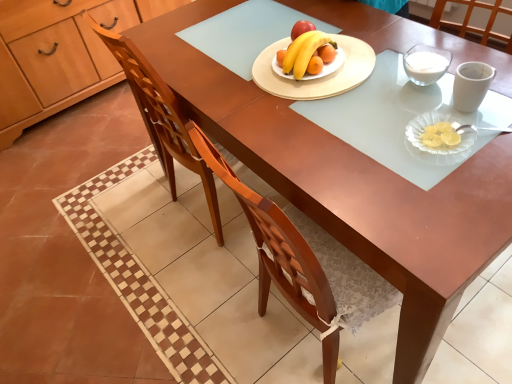
What do you see at coordinates (161, 117) in the screenshot?
I see `wooden chair at center` at bounding box center [161, 117].

The width and height of the screenshot is (512, 384). I want to click on yellow matte banana at center, so click(304, 52).

This screenshot has width=512, height=384. I want to click on wooden chair at center, so click(x=161, y=117).

Which of these two, wooden chair at center or yellow matte banana at center, is bigger?

Bigger between the two is wooden chair at center.

Is wooden chair at center thinner than yellow matte banana at center?

Incorrect, the width of wooden chair at center is not less than that of yellow matte banana at center.

Based on the photo, which is more to the left, wooden chair at center or yellow matte banana at center?

Result: Positioned to the left is wooden chair at center.

Is point (160, 140) in front of point (284, 67)?

That is False.

Is wooden cabinet at left facing away from yellow matte banana at center?

wooden cabinet at left does not have its back to yellow matte banana at center.

Based on the photo, from a real-world perspective, does wooden cabinet at left sit lower than yellow matte banana at center?

Yes, from a real-world perspective, wooden cabinet at left is beneath yellow matte banana at center.

From the image's perspective, between wooden cabinet at left and yellow matte banana at center, who is located below?

yellow matte banana at center, from the image's perspective.

Considering the points (63, 30) and (300, 72), which point is in front, point (63, 30) or point (300, 72)?

The point (300, 72) is more forward.

From the image's perspective, which one is positioned higher, yellow matte banana at center or wooden cabinet at left?

wooden cabinet at left is shown above in the image.

Identify the location of banana that is above the wooden cabinet at left (from a real-world perspective). Image resolution: width=512 pixels, height=384 pixels. (304, 52).

Looking at this image, is yellow matte banana at center with wooden cabinet at left?

No, yellow matte banana at center is not next to wooden cabinet at left.

How many degrees apart are the facing directions of yellow matte banana at center and clear glass platter at lower right, which is the first platter from bottom to top?

0.000267 degrees separate the facing orientations of yellow matte banana at center and clear glass platter at lower right, which is the first platter from bottom to top.

Who is more distant, yellow matte banana at center or clear glass platter at lower right, which is the first platter from bottom to top?

yellow matte banana at center is further from the camera.

Considering the points (302, 38) and (463, 148), which point is in front, point (302, 38) or point (463, 148)?

Point (463, 148)

Between yellow matte banana at center and clear glass platter at lower right, positioned as the first platter in front-to-back order, which one has more height?

yellow matte banana at center is taller.

Could you tell me if yellow matte banana at center is facing wooden chair at center?

No, yellow matte banana at center is not facing towards wooden chair at center.

Is yellow matte banana at center bigger or smaller than wooden chair at center?

Clearly, yellow matte banana at center is smaller in size than wooden chair at center.

From the image's perspective, is yellow matte banana at center positioned above or below wooden chair at center?

From the image's perspective, yellow matte banana at center appears above wooden chair at center.

Would you consider yellow matte banana at center to be distant from wooden chair at center?

Actually, yellow matte banana at center and wooden chair at center are a little close together.

Is the surface of wooden chair at center in direct contact with wooden cabinet at left?

wooden chair at center and wooden cabinet at left are not in contact.

Considering the relative sizes of wooden chair at center and wooden cabinet at left in the image provided, is wooden chair at center smaller than wooden cabinet at left?

Correct, wooden chair at center occupies less space than wooden cabinet at left.

Is wooden chair at center positioned with its back to wooden cabinet at left?

wooden chair at center does not have its back to wooden cabinet at left.

Is wooden chair at center shorter than wooden cabinet at left?

In fact, wooden chair at center may be taller than wooden cabinet at left.

Image resolution: width=512 pixels, height=384 pixels. I want to click on platter that is the 2nd one when counting rightward from the wooden chair at center, so click(432, 124).

From their relative heights in the image, would you say clear glass platter at lower right, positioned as the first platter in front-to-back order, is taller or shorter than wooden chair at center?

Clearly, clear glass platter at lower right, positioned as the first platter in front-to-back order, is shorter compared to wooden chair at center.

Based on their positions, is clear glass platter at lower right, which is the first platter from bottom to top, located to the left or right of wooden chair at center?

clear glass platter at lower right, which is the first platter from bottom to top, is positioned on wooden chair at center's right side.

From a real-world perspective, is clear glass platter at lower right, positioned as the 2th platter in top-to-bottom order, located higher than wooden chair at center?

Yes, from a real-world perspective, clear glass platter at lower right, positioned as the 2th platter in top-to-bottom order, is on top of wooden chair at center.

Identify the location of banana above the wooden chair at center (from the image's perspective). This screenshot has width=512, height=384. (304, 52).

Find the location of a particular element. cabinetry that is behind the yellow matte banana at center is located at coordinates (60, 54).

Based on their spatial positions, is clear glass platter at lower right, placed as the 1th platter when sorted from right to left, or yellow matte banana at center further from wooden chair at center?

clear glass platter at lower right, placed as the 1th platter when sorted from right to left, is further to wooden chair at center.

Which object lies further to the anchor point wooden cabinet at left, wooden chair at center or clear glass platter at lower right, which appears as the second platter when viewed from the left?

clear glass platter at lower right, which appears as the second platter when viewed from the left, is positioned further to the anchor wooden cabinet at left.

Estimate the real-world distances between objects in this image. Which object is closer to wooden round platter at center, which is counted as the first platter, starting from the left, wooden cabinet at left or yellow matte banana at center?

yellow matte banana at center is positioned closer to the anchor wooden round platter at center, which is counted as the first platter, starting from the left.

When comparing their distances from wooden cabinet at left, does yellow matte banana at center or wooden chair at center seem closer?

wooden chair at center.

From the image, which object appears to be farther from wooden cabinet at left, yellow matte banana at center or clear glass platter at lower right, which is the first platter from bottom to top?

The object further to wooden cabinet at left is clear glass platter at lower right, which is the first platter from bottom to top.

Considering their positions, is wooden chair at center positioned closer to clear glass platter at lower right, placed as the 1th platter when sorted from right to left, than wooden round platter at center, which ranks as the first platter in back-to-front order?

Based on the image, wooden round platter at center, which ranks as the first platter in back-to-front order, appears to be nearer to clear glass platter at lower right, placed as the 1th platter when sorted from right to left.

Considering their positions, is wooden chair at center positioned further to wooden round platter at center, which ranks as the first platter in back-to-front order, than clear glass platter at lower right, positioned as the 2th platter in top-to-bottom order?

The object further to wooden round platter at center, which ranks as the first platter in back-to-front order, is wooden chair at center.

Looking at the image, which one is located further to yellow matte banana at center, wooden chair at center or clear glass platter at lower right, which is the first platter from bottom to top?

wooden chair at center lies further to yellow matte banana at center than the other object.

Identify the location of banana between wooden cabinet at left and wooden round platter at center, which ranks as the first platter in back-to-front order, in the horizontal direction. The height and width of the screenshot is (384, 512). click(304, 52).

Find the location of a particular element. The height and width of the screenshot is (384, 512). banana located between wooden cabinet at left and clear glass platter at lower right, placed as the 1th platter when sorted from right to left, in the left-right direction is located at coordinates (304, 52).

Where is `chair located between wooden cabinet at left and wooden round platter at center, which is the second platter in front-to-back order, in the left-right direction`? chair located between wooden cabinet at left and wooden round platter at center, which is the second platter in front-to-back order, in the left-right direction is located at coordinates (161, 117).

Identify the location of platter located between wooden cabinet at left and clear glass platter at lower right, which appears as the second platter when viewed from the left, in the left-right direction. (318, 78).